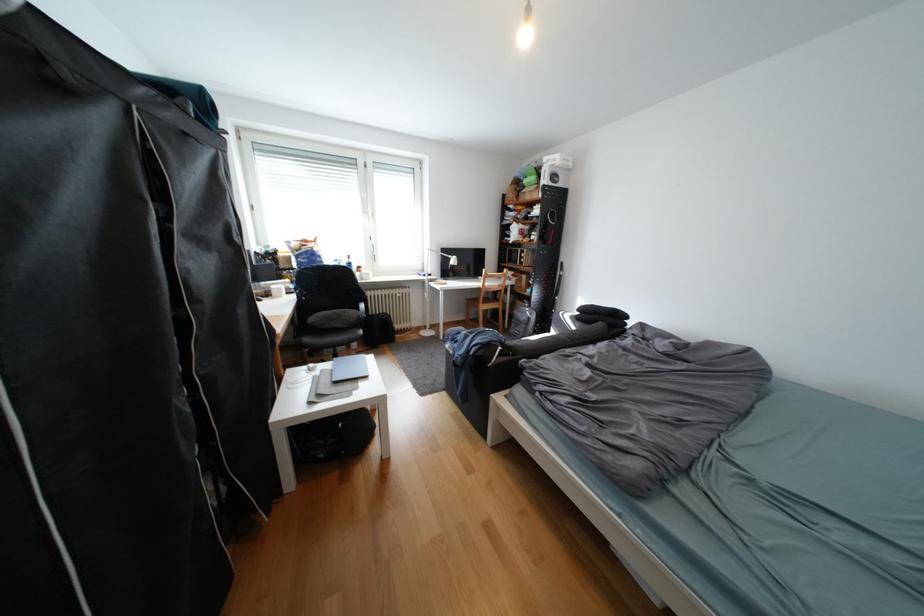
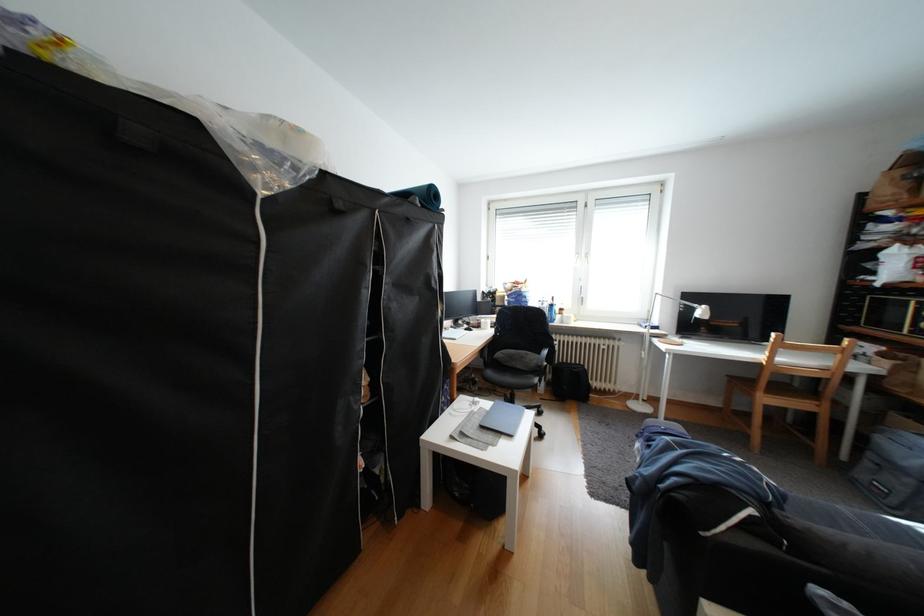
Find the pixel in the second image that matches [371,310] in the first image.

(553, 354)